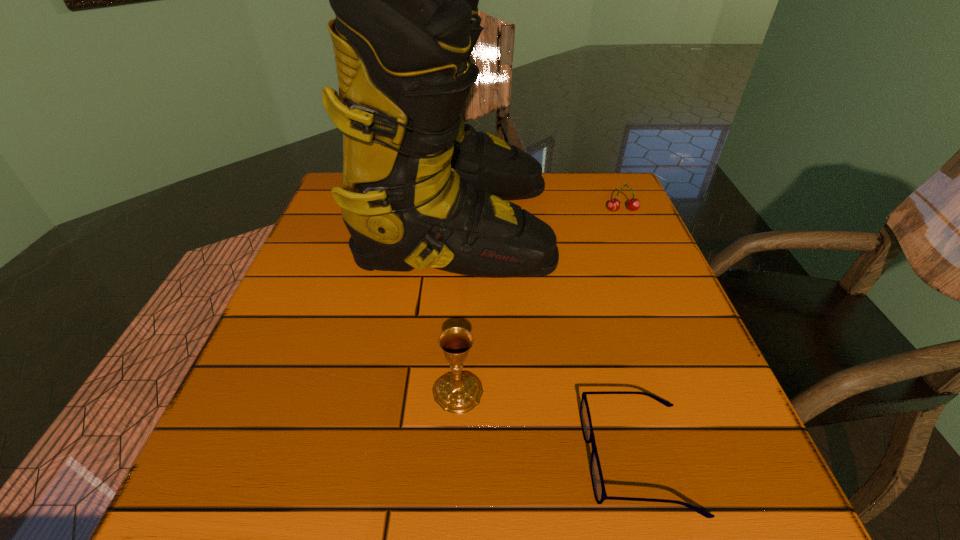
The width and height of the screenshot is (960, 540). What are the coordinates of `ski boots` in the screenshot? It's located at (420, 189).

The width and height of the screenshot is (960, 540). I want to click on the third shortest object, so click(459, 392).

This screenshot has height=540, width=960. What are the coordinates of `the second shortest object` in the screenshot? It's located at (633, 204).

Locate an element on the screen. cherry is located at coordinates point(633,204).

I want to click on spectacles, so click(x=597, y=479).

I want to click on vacant space located on the right of the tallest object, so click(638, 224).

Find the location of a particular element. free region located 0.310m on the left of the chalice is located at coordinates (249, 392).

Find the location of `free space located with stems pointing upwards on the rightmost object`. free space located with stems pointing upwards on the rightmost object is located at coordinates (629, 226).

At what (x,y) coordinates should I click in order to perform the action: click on free space located on the front-facing side of the shortest object. Please return your answer as a coordinate pair (x, y). This screenshot has height=540, width=960. Looking at the image, I should click on (405, 458).

Find the location of a particular element. This screenshot has height=540, width=960. free location located on the front-facing side of the shortest object is located at coordinates (372, 458).